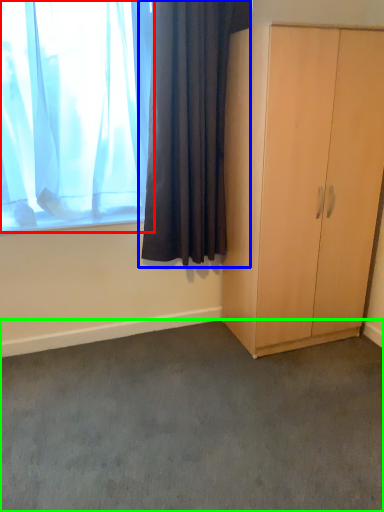
Question: Based on their relative distances, which object is nearer to curtain (highlighted by a red box)? Choose from curtain (highlighted by a blue box) and plain (highlighted by a green box).

Choices:
 (A) curtain
 (B) plain

Answer: (A)